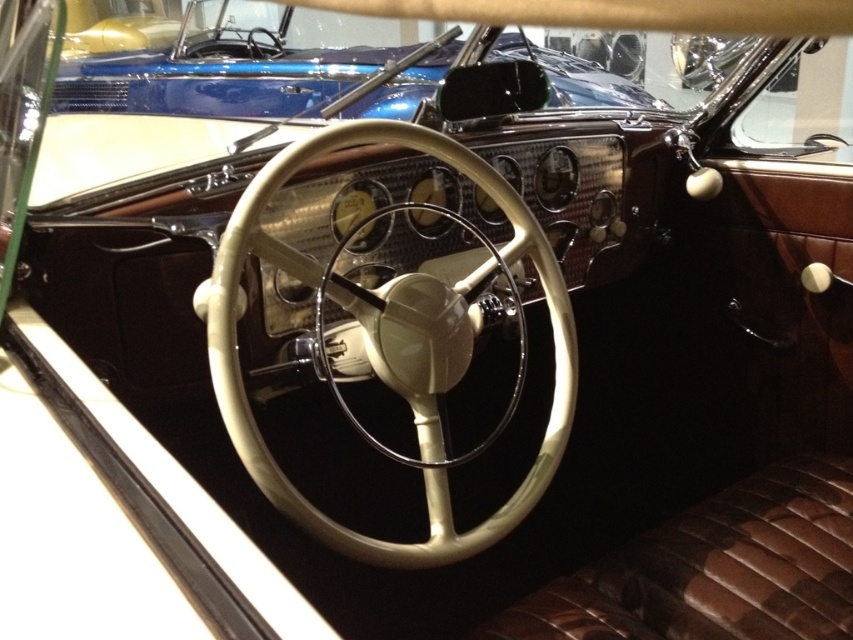
Question: Which of the following is the closest to the observer?

Choices:
 (A) beige leather steering wheel at center
 (B) metallic blue car at upper center

Answer: (A)

Question: Is beige leather steering wheel at center above metallic blue car at upper center?

Choices:
 (A) no
 (B) yes

Answer: (A)

Question: Can you confirm if beige leather steering wheel at center is wider than metallic blue car at upper center?

Choices:
 (A) yes
 (B) no

Answer: (B)

Question: Can you confirm if beige leather steering wheel at center is thinner than metallic blue car at upper center?

Choices:
 (A) yes
 (B) no

Answer: (A)